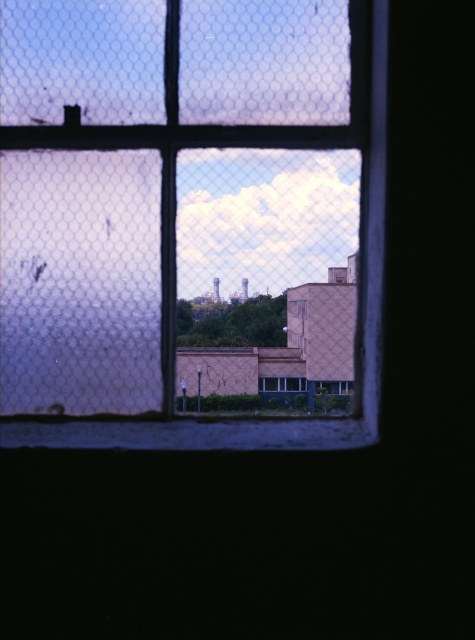
Can you confirm if clear glass window at center is positioned to the left of blue glass window at center?

Yes, clear glass window at center is to the left of blue glass window at center.

Is point (267, 444) farther from viewer compared to point (285, 381)?

That is False.

This screenshot has height=640, width=475. What are the coordinates of `clear glass window at center` in the screenshot? It's located at (252, 147).